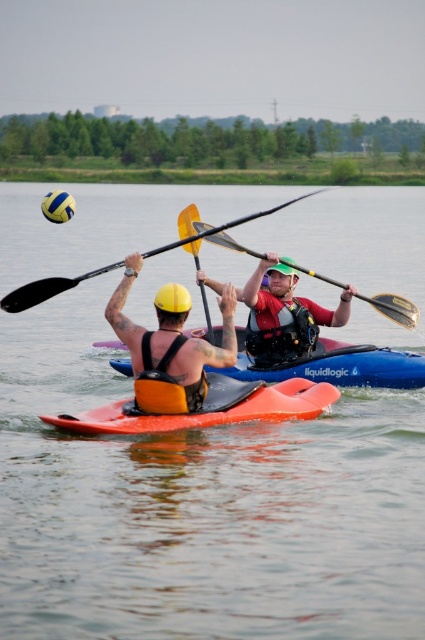
Question: Does orange kayak at center have a lesser width compared to yellow matte paddle at center?

Choices:
 (A) no
 (B) yes

Answer: (A)

Question: Which of the following is the farthest from the observer?

Choices:
 (A) yellow matte paddle at center
 (B) red life jacket at center

Answer: (B)

Question: Which object appears closest to the camera in this image?

Choices:
 (A) transparent water at center
 (B) red life jacket at center
 (C) orange life vest at center
 (D) yellow matte paddle at upper center

Answer: (A)

Question: Does orange life vest at center appear on the left side of orange matte kayak at center?

Choices:
 (A) no
 (B) yes

Answer: (A)

Question: Can you confirm if red life jacket at center is bigger than yellow wood paddle at upper center?

Choices:
 (A) no
 (B) yes

Answer: (A)

Question: Which of these objects is positioned farthest from the orange kayak at center?

Choices:
 (A) yellow matte paddle at upper center
 (B) yellow wood paddle at upper center
 (C) yellow matte paddle at center

Answer: (B)